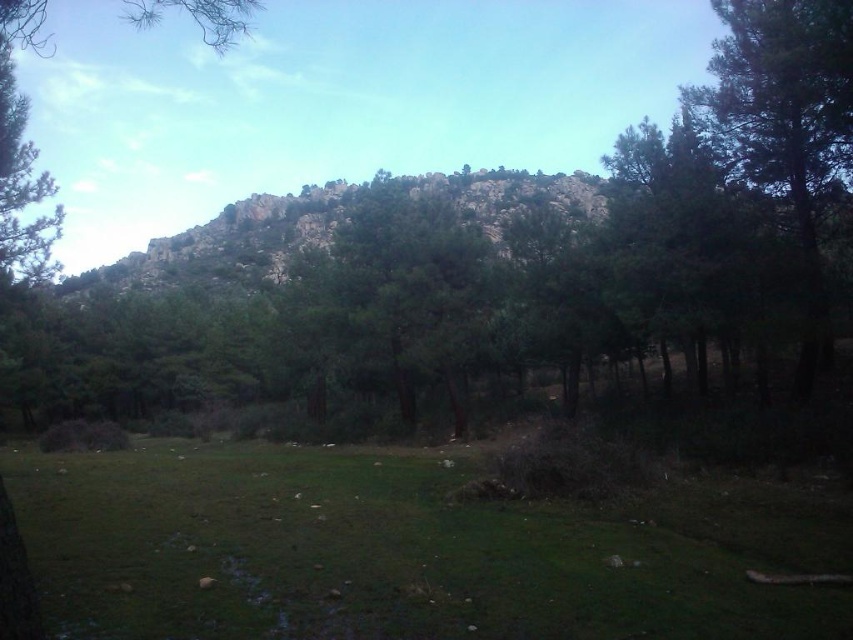
You are a hiker who wants to cross the green grassy field at lower left and the green textured tree at center. Which area would be easier to walk through based on their thickness?

The green grassy field at lower left is thinner than the green textured tree at center, so it would be easier to walk through the green grassy field at lower left.

You are standing in the serene natural landscape and want to walk from the green grassy field at lower left to the green textured tree at center. Which direction should you move to get closer to the tree?

To reach the green textured tree at center from the green grassy field at lower left, you should move toward the center of the image since the tree is farther away from the viewer compared to the field.